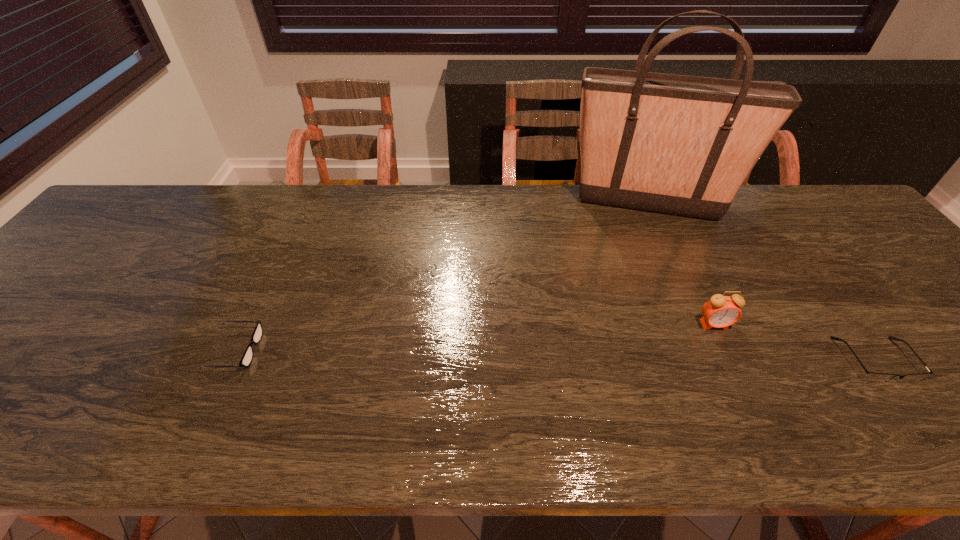
Identify the location of vacant space that is in between the farthest object and the alarm clock. The height and width of the screenshot is (540, 960). (681, 264).

Image resolution: width=960 pixels, height=540 pixels. In order to click on empty location between the rightmost object and the tallest object in this screenshot , I will do `click(761, 282)`.

The width and height of the screenshot is (960, 540). I want to click on free point between the right spectacles and the left spectacles, so click(x=555, y=355).

The image size is (960, 540). What are the coordinates of `vacant point located between the left spectacles and the right spectacles` in the screenshot? It's located at (555, 355).

Find the location of a particular element. free area in between the alarm clock and the right spectacles is located at coordinates (795, 342).

In order to click on free area in between the third shortest object and the right spectacles in this screenshot , I will do `click(795, 342)`.

Locate an element on the screen. object that stands as the third closest to the farthest object is located at coordinates (246, 359).

Find the location of a particular element. the closest object to the rightmost object is located at coordinates (720, 311).

Identify the location of free point that satisfies the following two spatial constraints: 1. on the face of the third shortest object; 2. on the front-facing side of the left spectacles. (726, 349).